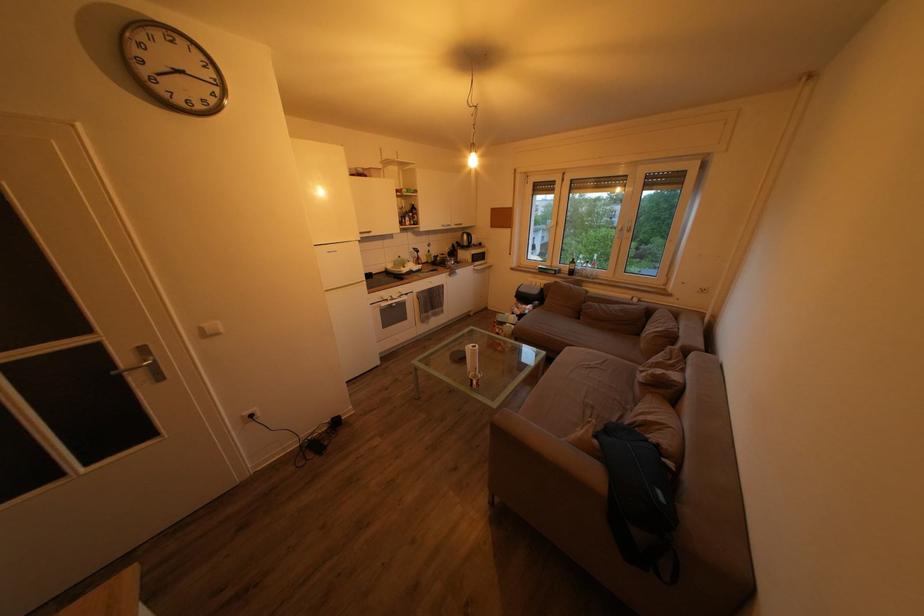
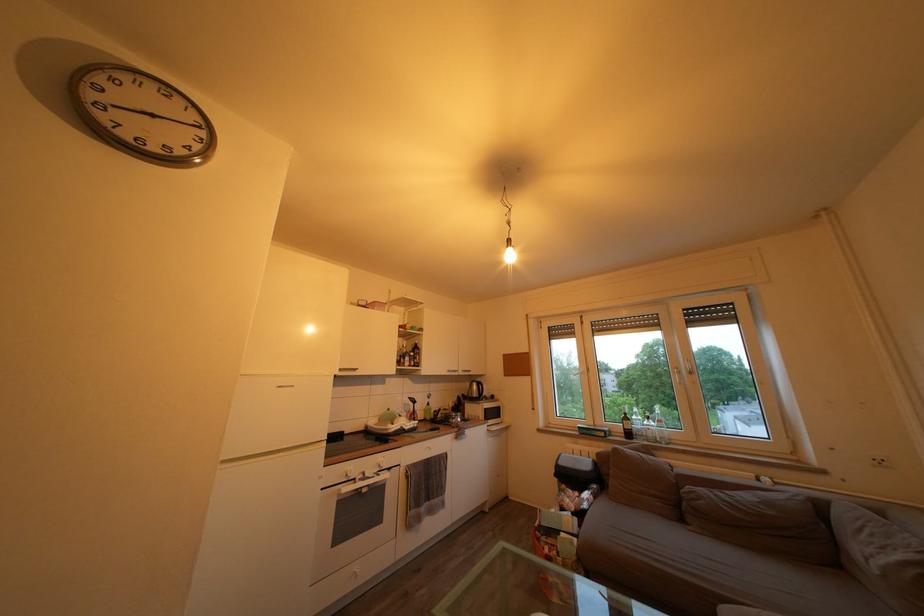
Where in the second image is the point corresponding to (x=581, y=268) from the first image?

(635, 424)